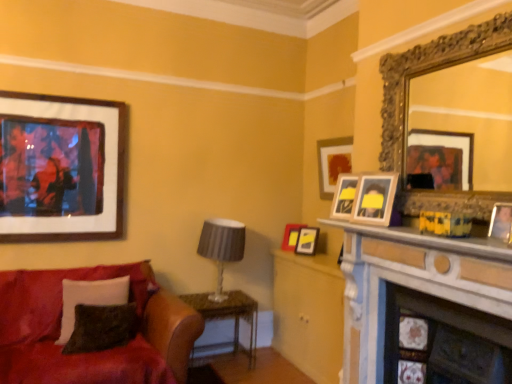
Question: Is white marble fireplace at center, which is counted as the 1th fireplace, starting from the top, wider or thinner than gold ornate mirror at upper right?

Choices:
 (A) wide
 (B) thin

Answer: (A)

Question: Considering their positions, is white marble fireplace at center, which is counted as the 1th fireplace, starting from the top, located in front of or behind gold ornate mirror at upper right?

Choices:
 (A) behind
 (B) front

Answer: (B)

Question: Considering the real-world distances, which object is closest to the marble fireplace at lower right, which ranks as the first fireplace in bottom-to-top order?

Choices:
 (A) wooden picture frame at right, which is the fifth picture frame from left to right
 (B) white marble fireplace at center, the 2th fireplace positioned from the bottom
 (C) velvet black pillow at lower left, the 2th pillow positioned from the back
 (D) wooden photo frame at center, which appears as the fourth picture frame when viewed from the back
 (E) velvety black pillow at lower left, the first pillow viewed from the back

Answer: (B)

Question: Based on their relative distances, which object is nearer to the wooden framed artwork at upper left, the first picture frame positioned from the left?

Choices:
 (A) matte red picture frame at center, arranged as the 2th picture frame when viewed from the left
 (B) velvet black pillow at lower left, the first pillow from the front
 (C) satin red couch at lower left
 (D) marble fireplace at lower right, which ranks as the first fireplace in bottom-to-top order
 (E) matte gray lampshade at center

Answer: (C)